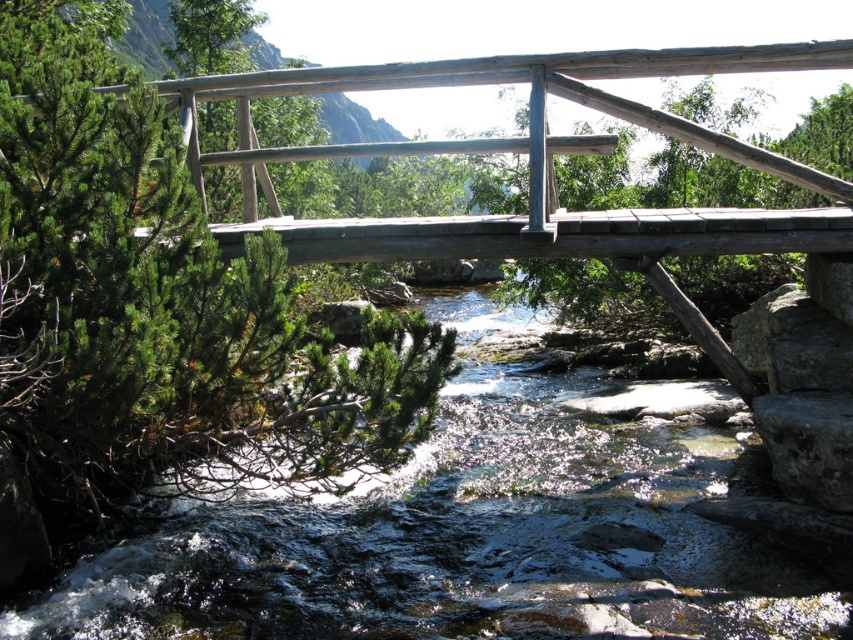
Can you confirm if clear water at center is positioned to the left of natural wood bridge at center?

In fact, clear water at center is to the right of natural wood bridge at center.

Who is higher up, clear water at center or natural wood bridge at center?

Positioned higher is natural wood bridge at center.

Find the location of a particular element. Image resolution: width=853 pixels, height=640 pixels. clear water at center is located at coordinates (477, 534).